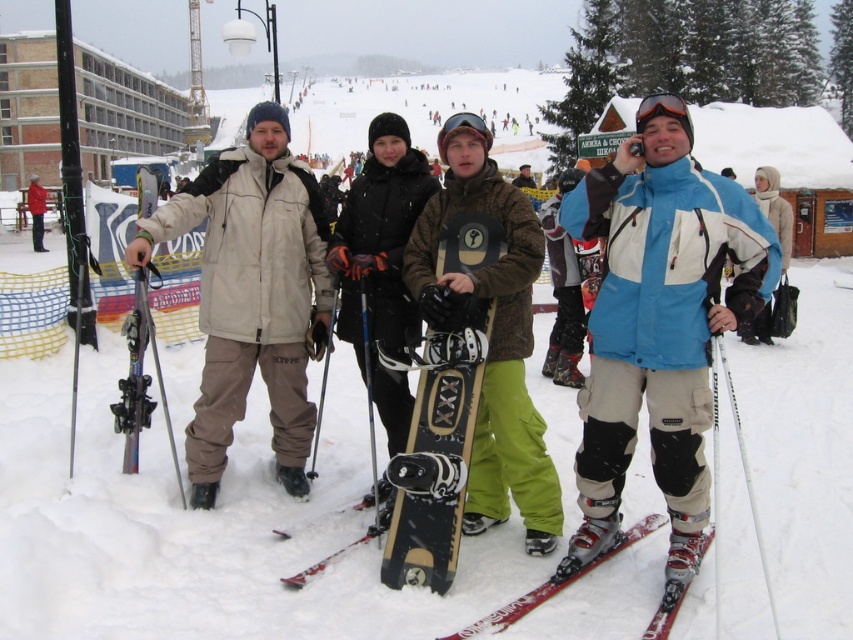
Question: Is matte beige jacket at center positioned before black matte snowboard at center?

Choices:
 (A) yes
 (B) no

Answer: (B)

Question: Which of these objects is positioned farthest from the shiny black ski at center?

Choices:
 (A) black matte snowboard at center
 (B) camouflage-patterned snowboard at center

Answer: (B)

Question: Does camouflage-patterned snowboard at center have a larger size compared to shiny metallic skis at lower right?

Choices:
 (A) no
 (B) yes

Answer: (B)

Question: Which point is farther to the camera?

Choices:
 (A) shiny metallic skis at lower right
 (B) matte beige jacket at center
 (C) shiny black ski at center
 (D) matte black goggles at center

Answer: (B)

Question: Considering the relative positions of shiny metallic skis at lower right and glossy plastic goggles at upper center in the image provided, where is shiny metallic skis at lower right located with respect to glossy plastic goggles at upper center?

Choices:
 (A) below
 (B) above

Answer: (A)

Question: Which of these objects is positioned farthest from the camouflage-patterned snowboard at center?

Choices:
 (A) shiny black ski at center
 (B) matte black goggles at center

Answer: (B)